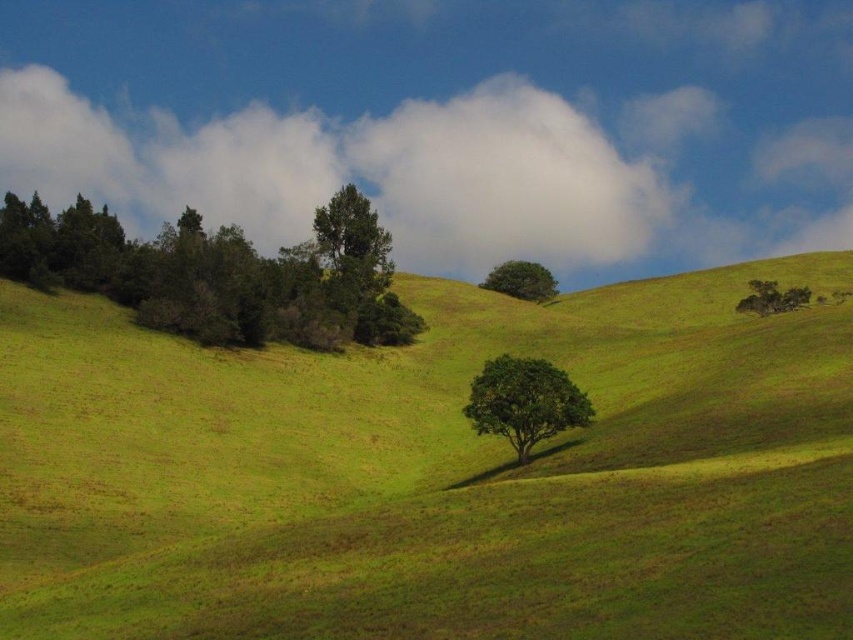
Question: Does green grassy hillside at center have a greater width compared to green leafy tree at upper center?

Choices:
 (A) yes
 (B) no

Answer: (A)

Question: Can you confirm if green leafy trees at left is bigger than green leafy tree at upper right?

Choices:
 (A) yes
 (B) no

Answer: (A)

Question: Which point is closer to the camera taking this photo?

Choices:
 (A) (802, 300)
 (B) (41, 276)

Answer: (B)

Question: Based on their relative distances, which object is farther from the green matte tree at center?

Choices:
 (A) green leafy tree at upper right
 (B) green leafy tree at upper center
 (C) green grassy hillside at center
 (D) green leafy trees at left

Answer: (C)

Question: Considering the relative positions of white fluffy cloud at upper center and green leafy tree at upper right in the image provided, where is white fluffy cloud at upper center located with respect to green leafy tree at upper right?

Choices:
 (A) below
 (B) above

Answer: (B)

Question: Which object appears farthest from the camera in this image?

Choices:
 (A) green leafy tree at upper center
 (B) green leafy tree at upper right

Answer: (A)